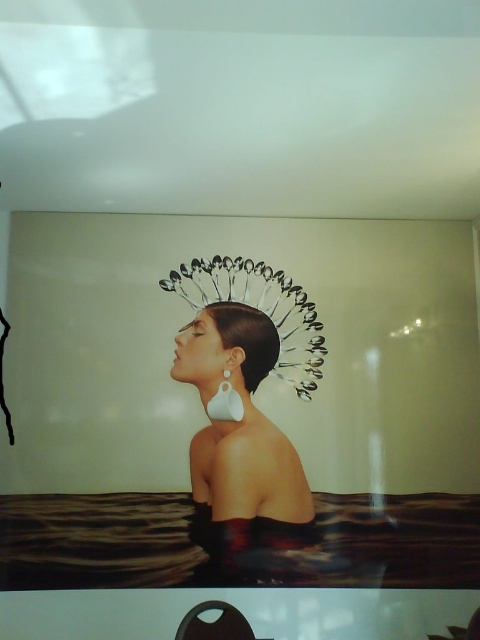
You are an artist observing the scene and want to paint the position of the white matte crown at center and white matte earring at center. Which object is located more to the left?

The white matte earring at center is more to the left because the white matte crown at center is positioned to its right.

Consider the image. You are an artist trying to create a miniature version of this scene. You need to ensure that the proportions between the silver metallic spoons at upper center and the white matte earring at center are accurate. Which object should you make larger in your model?

The silver metallic spoons at upper center should be made larger in the model since they might be wider than the white matte earring at center according to the description.

You are an artist preparing to paint this surreal scene. You need to know the spatial relationship between the white matte crown at center and the white matte earring at center. Is the crown above or below the earring?

The white matte crown at center is positioned under the white matte earring at center, so the crown is below the earring.